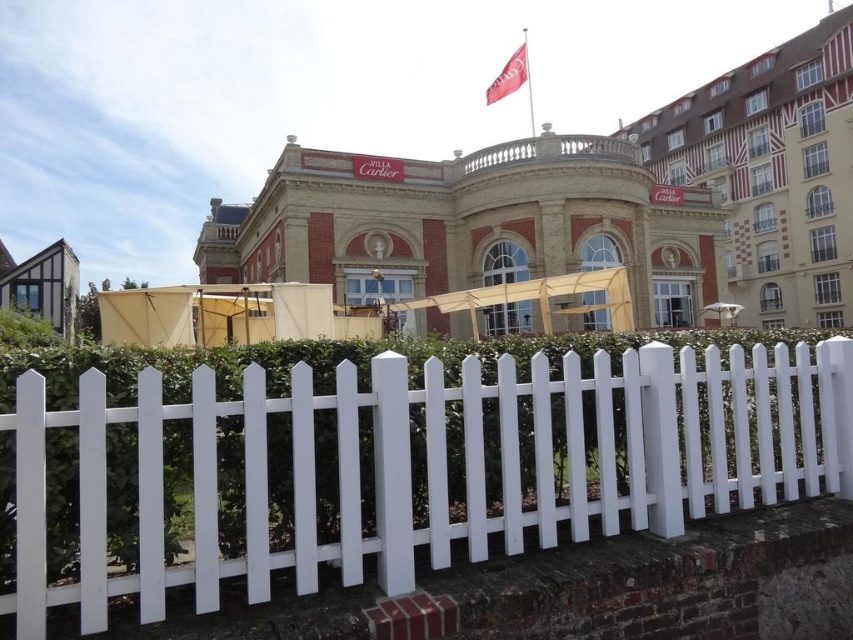
Question: Is red brick building at center wider than red brick building at upper right?

Choices:
 (A) yes
 (B) no

Answer: (A)

Question: Can you confirm if dark gray timbered house at left is positioned to the right of red fabric flag at upper center?

Choices:
 (A) yes
 (B) no

Answer: (B)

Question: Estimate the real-world distances between objects in this image. Which object is farther from the white picket fence at center?

Choices:
 (A) red fabric flag at upper center
 (B) red brick building at upper right
 (C) dark gray timbered house at left
 (D) red brick building at center

Answer: (B)

Question: Among these points, which one is farthest from the camera?

Choices:
 (A) (57, 266)
 (B) (515, 154)

Answer: (A)

Question: Can you confirm if red brick building at center is bigger than dark gray timbered house at left?

Choices:
 (A) yes
 (B) no

Answer: (A)

Question: Which point appears closest to the camera in this image?

Choices:
 (A) (544, 547)
 (B) (64, 266)
 (C) (496, 90)
 (D) (563, 195)

Answer: (A)